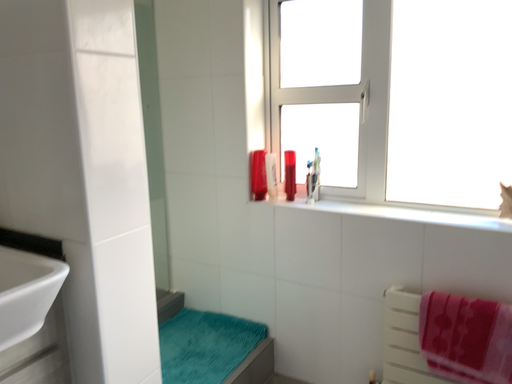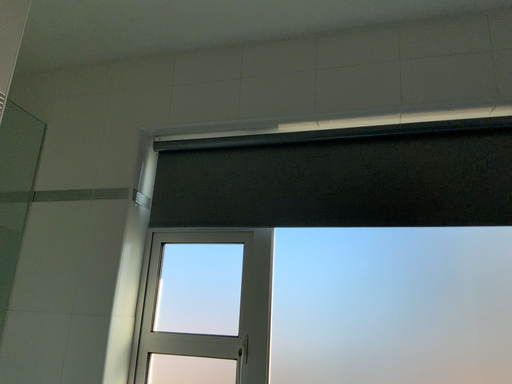
Question: How did the camera likely rotate when shooting the video?

Choices:
 (A) rotated left
 (B) rotated right

Answer: (B)